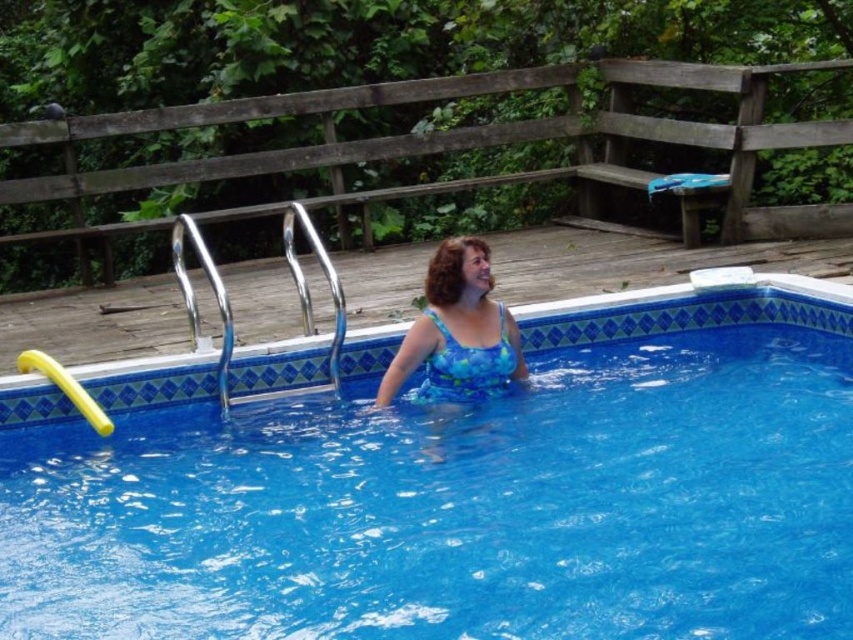
Question: Which point is closer to the camera taking this photo?

Choices:
 (A) (207, 506)
 (B) (421, 339)

Answer: (A)

Question: Which object is closer to the camera taking this photo?

Choices:
 (A) blue glossy water at center
 (B) blue printed swimsuit at center

Answer: (A)

Question: Observing the image, what is the correct spatial positioning of blue glossy water at center in reference to blue printed swimsuit at center?

Choices:
 (A) below
 (B) above

Answer: (A)

Question: Does blue glossy water at center lie in front of blue printed swimsuit at center?

Choices:
 (A) no
 (B) yes

Answer: (B)

Question: Is blue glossy water at center behind blue printed swimsuit at center?

Choices:
 (A) yes
 (B) no

Answer: (B)